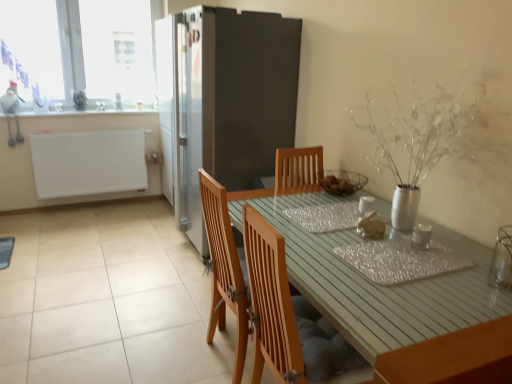
Measure the distance between white glossy counter top at upper left and camera.

white glossy counter top at upper left and camera are 3.71 meters apart from each other.

What do you see at coordinates (288, 316) in the screenshot? The height and width of the screenshot is (384, 512). I see `wooden chair at lower center, which is the first chair from front to back` at bounding box center [288, 316].

In order to face wooden chair at lower center, the 2th chair in the back-to-front sequence, should I rotate leftwards or rightwards?

A 6.553 degree turn to the right will do.

Find the location of a particular element. The width and height of the screenshot is (512, 384). matte gold bunny at center is located at coordinates (371, 226).

The image size is (512, 384). What do you see at coordinates (79, 54) in the screenshot?
I see `transparent glass window at upper left` at bounding box center [79, 54].

At what (x,y) coordinates should I click in order to perform the action: click on white glossy counter top at upper left. Please return your answer as a coordinate pair (x, y). This screenshot has height=384, width=512. Looking at the image, I should click on [x=74, y=111].

Would you say wooden chair at lower center, the 2th chair in the back-to-front sequence, is inside or outside shiny metallic placemat at center?

wooden chair at lower center, the 2th chair in the back-to-front sequence, is located beyond the bounds of shiny metallic placemat at center.

Does wooden chair at lower center, which is the first chair from front to back, touch shiny metallic placemat at center?

No.

Considering the relative sizes of wooden chair at lower center, which is the first chair from front to back, and shiny metallic placemat at center in the image provided, is wooden chair at lower center, which is the first chair from front to back, wider than shiny metallic placemat at center?

No.

Is white glossy counter top at upper left far away from satin silver fridge at center?

Yes.

Who is bigger, white glossy counter top at upper left or satin silver fridge at center?

Bigger between the two is satin silver fridge at center.

Is satin silver fridge at center at the back of white glossy counter top at upper left?

No, satin silver fridge at center is not at the back of white glossy counter top at upper left.

Can you confirm if wooden chair at lower center, the 2th chair in the back-to-front sequence, is positioned to the left of satin silver fridge at center?

Incorrect, wooden chair at lower center, the 2th chair in the back-to-front sequence, is not on the left side of satin silver fridge at center.

Is wooden chair at lower center, which is the first chair from front to back, shorter than satin silver fridge at center?

Indeed, wooden chair at lower center, which is the first chair from front to back, has a lesser height compared to satin silver fridge at center.

How many degrees apart are the facing directions of wooden chair at lower center, which is the first chair from front to back, and satin silver fridge at center?

There is a 180-degree angle between the facing directions of wooden chair at lower center, which is the first chair from front to back, and satin silver fridge at center.

Which is correct: wooden chair at lower center, the 2th chair in the back-to-front sequence, is inside satin silver fridge at center, or outside of it?

wooden chair at lower center, the 2th chair in the back-to-front sequence, lies outside satin silver fridge at center.

Between wooden chair at lower center, which is the first chair from front to back, and white matte radiator at left, which one appears on the right side from the viewer's perspective?

From the viewer's perspective, wooden chair at lower center, which is the first chair from front to back, appears more on the right side.

Considering the points (268, 261) and (45, 190), which point is behind, point (268, 261) or point (45, 190)?

Positioned behind is point (45, 190).

Does wooden chair at lower center, which is the first chair from front to back, come in front of white matte radiator at left?

Yes, the depth of wooden chair at lower center, which is the first chair from front to back, is less than that of white matte radiator at left.

From the image's perspective, is wooden chair at lower center, the 2th chair in the back-to-front sequence, below white matte radiator at left?

Indeed, from the image's perspective, wooden chair at lower center, the 2th chair in the back-to-front sequence, is shown beneath white matte radiator at left.

Does point (249, 245) appear closer or farther from the camera than point (182, 191)?

Clearly, point (249, 245) is closer to the camera than point (182, 191).

Considering the relative sizes of wooden chair at center, acting as the first chair starting from the back, and satin silver fridge at center in the image provided, is wooden chair at center, acting as the first chair starting from the back, smaller than satin silver fridge at center?

Yes, wooden chair at center, acting as the first chair starting from the back, is smaller than satin silver fridge at center.

Would you say wooden chair at center, acting as the first chair starting from the back, is outside satin silver fridge at center?

Yes, wooden chair at center, acting as the first chair starting from the back, is outside of satin silver fridge at center.

Can you tell me how much shiny metallic placemat at center and wooden chair at lower center, the 2th chair in the back-to-front sequence, differ in facing direction?

The facing directions of shiny metallic placemat at center and wooden chair at lower center, the 2th chair in the back-to-front sequence, are 180 degrees apart.

Between shiny metallic placemat at center and wooden chair at lower center, which is the first chair from front to back, which one appears on the left side from the viewer's perspective?

From the viewer's perspective, wooden chair at lower center, which is the first chair from front to back, appears more on the left side.

Considering the positions of objects shiny metallic placemat at center and wooden chair at lower center, which is the first chair from front to back, in the image provided, who is behind, shiny metallic placemat at center or wooden chair at lower center, which is the first chair from front to back,?

shiny metallic placemat at center.

From the image's perspective, is shiny metallic placemat at center positioned above or below wooden chair at lower center, which is the first chair from front to back?

shiny metallic placemat at center is situated higher than wooden chair at lower center, which is the first chair from front to back, in the image.

From the image's perspective, does satin silver fridge at center appear lower than shiny metallic placemat at center?

No, from the image's perspective, satin silver fridge at center is not beneath shiny metallic placemat at center.

Is satin silver fridge at center positioned beyond the bounds of shiny metallic placemat at center?

Yes, satin silver fridge at center is located beyond the bounds of shiny metallic placemat at center.

Are satin silver fridge at center and shiny metallic placemat at center far apart?

satin silver fridge at center is positioned a significant distance from shiny metallic placemat at center.

Measure the distance from satin silver fridge at center to shiny metallic placemat at center.

They are 5.74 feet apart.

Locate an element on the screen. The image size is (512, 384). chair lying in front of the shiny metallic placemat at center is located at coordinates [288, 316].

Where is `counter top above the satin silver fridge at center (from the image's perspective)`? counter top above the satin silver fridge at center (from the image's perspective) is located at coordinates 74,111.

Looking at the image, which one is located further to transparent glass window at upper left, satin silver fridge at center or transparent plastic window screen at upper left?

Answer: satin silver fridge at center.

Looking at the image, which one is located closer to transparent plastic window screen at upper left, wooden chair at lower center, which is the first chair from front to back, or transparent glass window at upper left?

transparent glass window at upper left is closer to transparent plastic window screen at upper left.

From the image, which object appears to be farther from wooden chair at center, acting as the first chair starting from the back, wooden chair at lower center, which is the first chair from front to back, or white matte radiator at left?

white matte radiator at left is positioned further to the anchor wooden chair at center, acting as the first chair starting from the back.

Which object lies nearer to the anchor point white matte radiator at left, satin silver fridge at center or white glossy counter top at upper left?

white glossy counter top at upper left is positioned closer to the anchor white matte radiator at left.

Considering their positions, is wooden table at center positioned further to matte gold bunny at center than satin silver fridge at center?

Among the two, satin silver fridge at center is located further to matte gold bunny at center.

In the scene shown: Which object lies nearer to the anchor point shiny metallic placemat at center, wooden chair at lower center, the 2th chair in the back-to-front sequence, or satin silver fridge at center?

Among the two, wooden chair at lower center, the 2th chair in the back-to-front sequence, is located nearer to shiny metallic placemat at center.

Estimate the real-world distances between objects in this image. Which object is closer to transparent glass window at upper left, white glossy counter top at upper left or shiny metallic placemat at center?

The object closer to transparent glass window at upper left is white glossy counter top at upper left.

From the image, which object appears to be nearer to wooden table at center, wooden chair at lower center, the 2th chair in the back-to-front sequence, or matte gold bunny at center?

wooden chair at lower center, the 2th chair in the back-to-front sequence, lies closer to wooden table at center than the other object.

In order to click on window between wooden table at center and white matte radiator at left in the front-back direction in this screenshot , I will do `click(79, 54)`.

Image resolution: width=512 pixels, height=384 pixels. In order to click on window screen located between wooden chair at center, the 2th chair in the front-to-back sequence, and white glossy counter top at upper left in the depth direction in this screenshot , I will do `click(31, 48)`.

This screenshot has width=512, height=384. Find the location of `window screen located between wooden table at center and white matte radiator at left in the depth direction`. window screen located between wooden table at center and white matte radiator at left in the depth direction is located at coordinates (31, 48).

I want to click on fridge located between wooden table at center and white glossy counter top at upper left in the depth direction, so click(x=223, y=101).